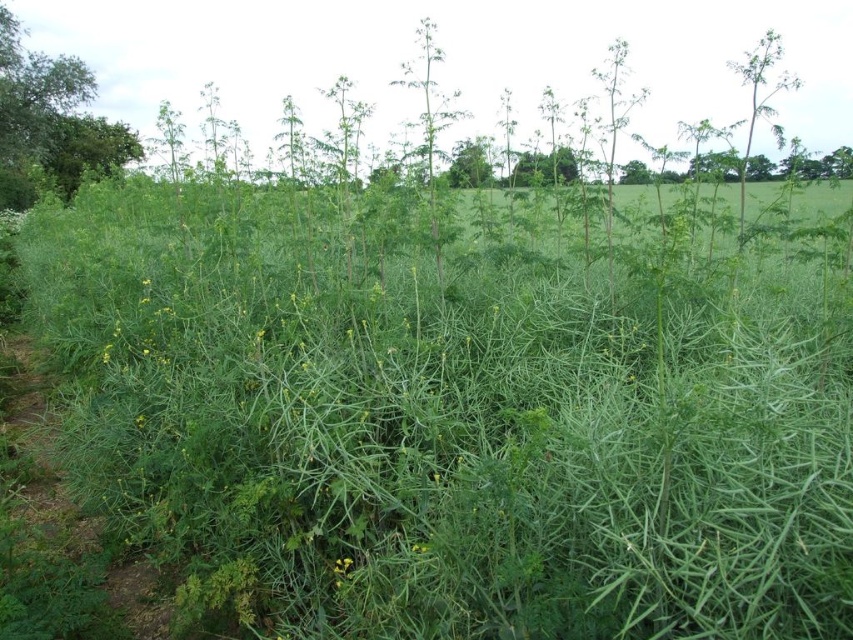
You are standing in the field and want to place a 24 inch long wooden board between the green leafy grass at center and another object. Is there enough space to fit the board horizontally?

The distance between the green leafy grass at center and the other object is 32.43 inches. Since the board is 24 inches long, there is enough space to fit it horizontally between them.

You are standing in the middle of the field and want to reach the green leafy tree at upper left. The green leafy grass at center is in your way. Can you walk through the grass to get to the tree?

The green leafy grass at center is 23.05 feet away from the green leafy tree at upper left. Since the grass is part of the field and not an obstacle, you can walk through the green leafy grass at center to reach the green leafy tree at upper left.